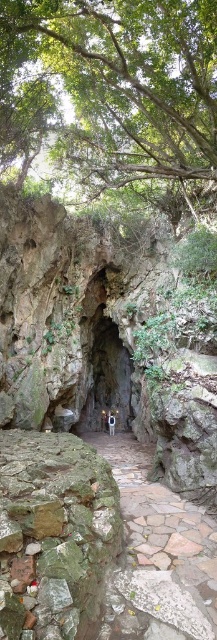
Consider the image. You are a hiker standing at the cave entrance and want to take a photo of the green leafy tree at upper center and the brown stone path at center. Which object should you focus on first to ensure both are in focus?

You should focus on the green leafy tree at upper center first because it is closer to you than the brown stone path at center, so adjusting focus from near to far will help both be in focus.

You are standing at the cave entrance and want to place a small marker at both point (x=203, y=81) and point (x=108, y=433). Which point is closer to your current position?

Point (x=203, y=81) is closer to the camera than point (x=108, y=433), so the marker at point (x=203, y=81) will be closer to your current position at the cave entrance.